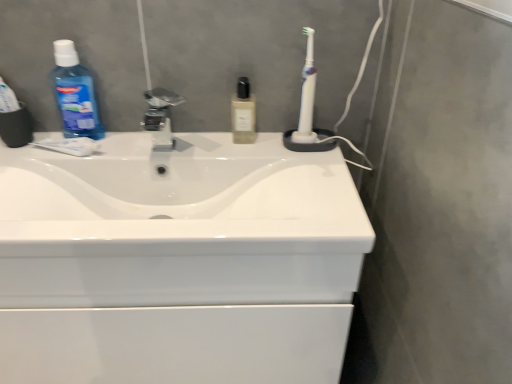
Image resolution: width=512 pixels, height=384 pixels. What are the coordinates of `vacant space to the right of translucent glass bottle at center` in the screenshot? It's located at (298, 144).